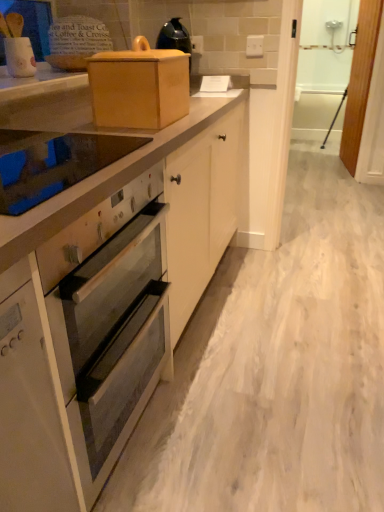
Question: Considering the positions of point (91, 392) and point (327, 121), is point (91, 392) closer or farther from the camera than point (327, 121)?

Choices:
 (A) farther
 (B) closer

Answer: (B)

Question: Is white glossy oven at center spatially inside white wood screen door at right, which ranks as the 1th screen door in left-to-right order, or outside of it?

Choices:
 (A) outside
 (B) inside

Answer: (A)

Question: Estimate the real-world distances between objects in this image. Which object is closer to the wooden box at upper center?

Choices:
 (A) white wood screen door at right, which ranks as the 1th screen door in left-to-right order
 (B) glass smooth cooktop at upper left
 (C) wooden screen door at right, the first screen door viewed from the right
 (D) white glossy oven at center

Answer: (B)

Question: Which object is positioned closest to the white glossy oven at center?

Choices:
 (A) wooden screen door at right, the first screen door viewed from the right
 (B) glass smooth cooktop at upper left
 (C) wooden box at upper center
 (D) white wood screen door at right, marked as the 2th screen door in a right-to-left arrangement

Answer: (B)